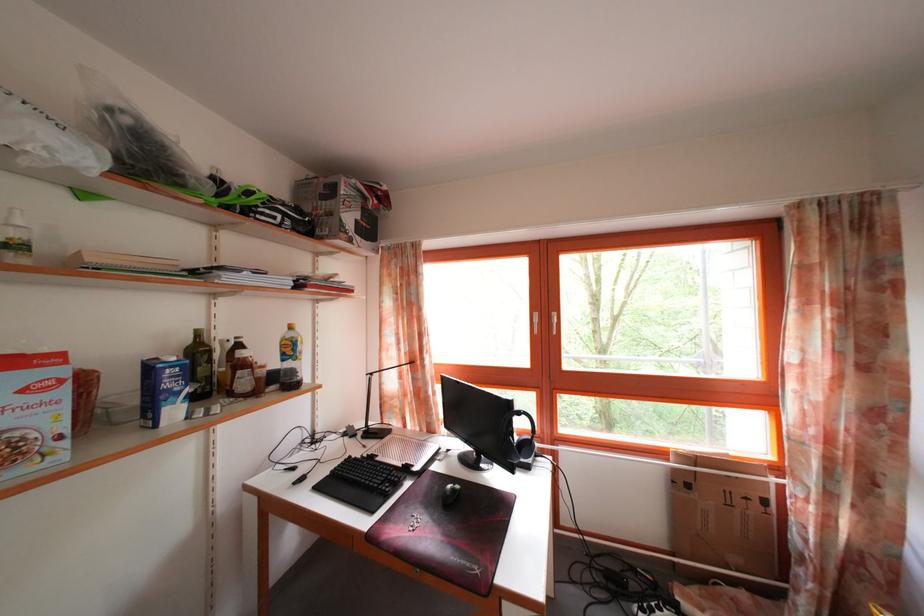
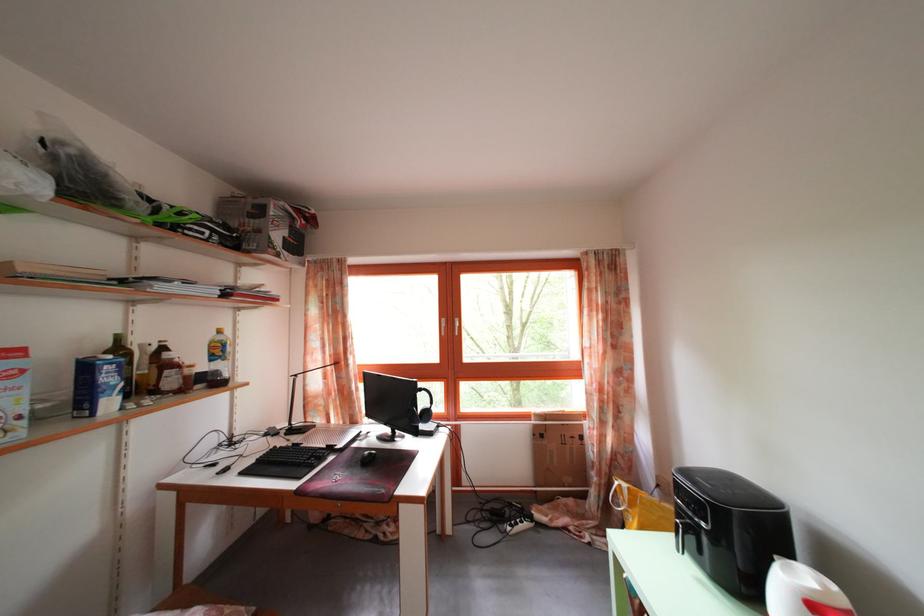
In the second image, find the point that corresponds to the point at 205,342 in the first image.

(126, 346)